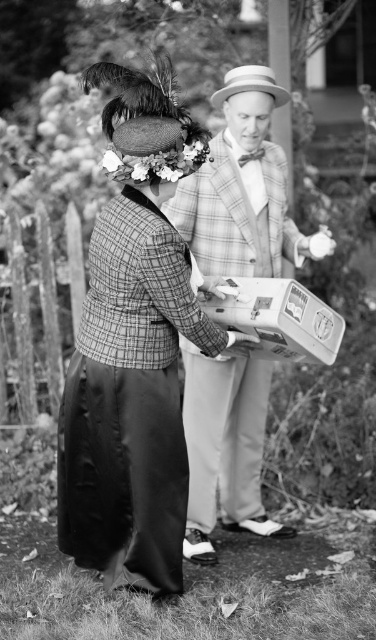
Question: Does plaid wool suit at center appear under floral bouquet at center?

Choices:
 (A) no
 (B) yes

Answer: (A)

Question: Which point is farther from the camera taking this photo?

Choices:
 (A) (194, 168)
 (B) (224, 509)

Answer: (B)

Question: Is plaid wool jacket at center positioned before plaid wool suit at center?

Choices:
 (A) yes
 (B) no

Answer: (A)

Question: Which point is farther to the camera?

Choices:
 (A) plaid wool jacket at center
 (B) plaid wool suit at center
 (C) floral bouquet at center

Answer: (B)

Question: Is plaid wool jacket at center bigger than plaid wool suit at center?

Choices:
 (A) no
 (B) yes

Answer: (B)

Question: Based on their relative distances, which object is nearer to the plaid wool jacket at center?

Choices:
 (A) floral bouquet at center
 (B) plaid wool suit at center

Answer: (A)